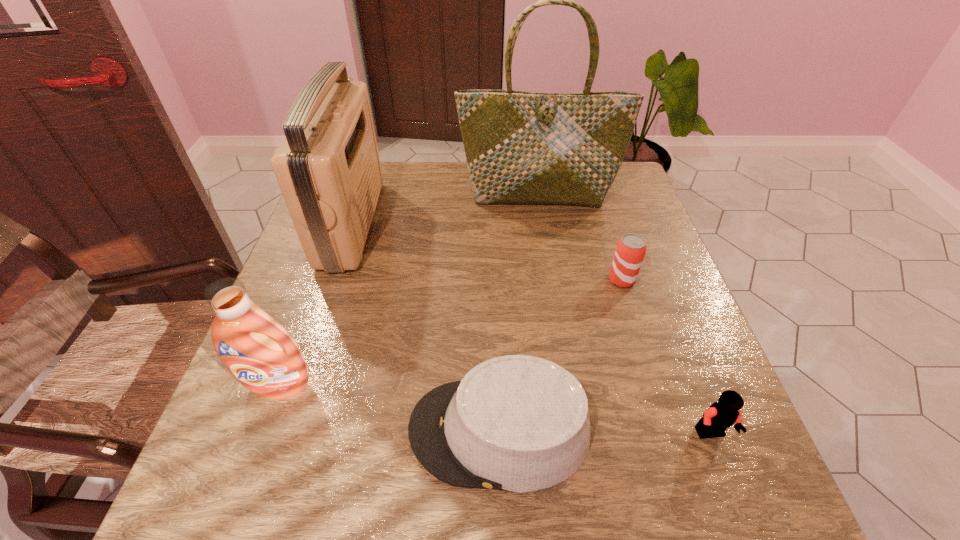
Find the location of `the tallest object`. the tallest object is located at coordinates (521, 147).

Where is `radio receiver`? The image size is (960, 540). radio receiver is located at coordinates (328, 168).

What are the coordinates of `detergent` in the screenshot? It's located at (260, 353).

In order to click on beer can in this screenshot , I will do pyautogui.click(x=631, y=248).

Find the location of `Lego`. Lego is located at coordinates coord(721,415).

Locate an element on the screen. This screenshot has width=960, height=540. hat is located at coordinates (518, 423).

Find the location of `vacant space situated 0.110m on the left of the tallest object`. vacant space situated 0.110m on the left of the tallest object is located at coordinates (420, 196).

This screenshot has width=960, height=540. I want to click on free space located 0.200m on the front-facing side of the fifth shortest object, so click(x=450, y=224).

Find the location of a particular element. blank space located on the front-facing side of the detergent is located at coordinates (246, 477).

Where is `blank space located on the back of the beer can`? blank space located on the back of the beer can is located at coordinates (594, 194).